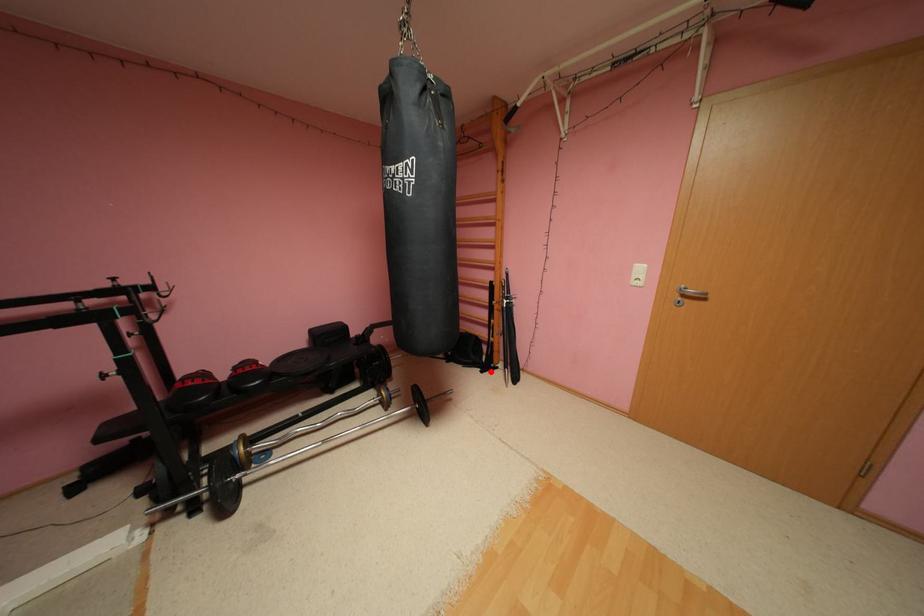
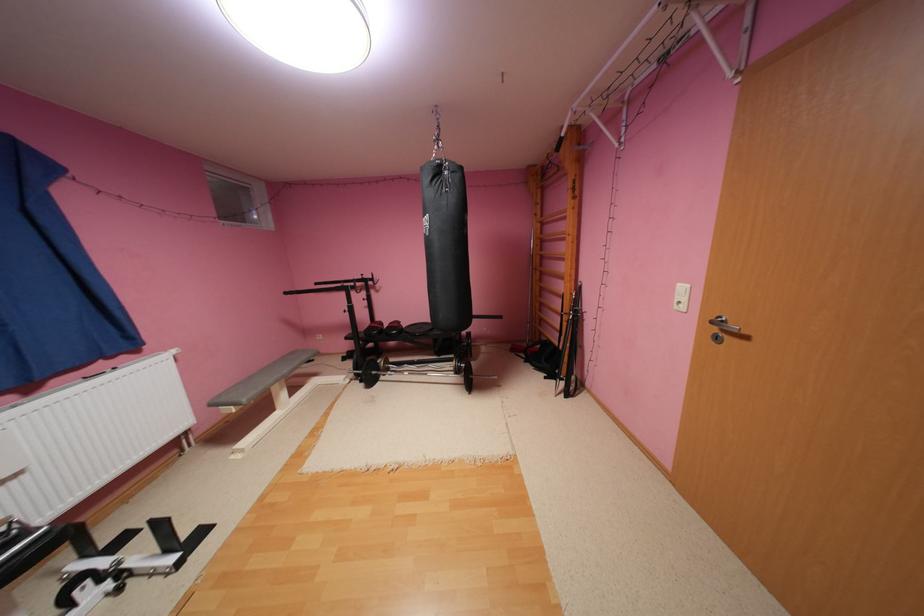
Question: A red point is marked in image1. In image2, is the corresponding 3D point closer to the camera or farther? Reply with the corresponding letter.

Choices:
 (A) The corresponding 3D point is closer.
 (B) The corresponding 3D point is farther.

Answer: (A)